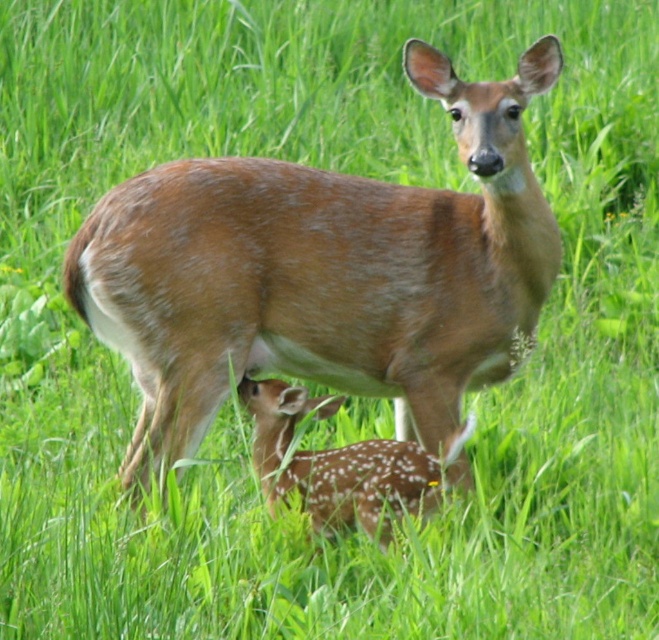
Who is positioned more to the right, brown fuzzy deer at center or fawn fur fawn at center?

Positioned to the right is fawn fur fawn at center.

Describe the element at coordinates (324, 273) in the screenshot. I see `brown fuzzy deer at center` at that location.

Who is more distant from viewer, [206,200] or [252,420]?

Point [252,420]

The height and width of the screenshot is (640, 659). I want to click on brown fuzzy deer at center, so click(324, 273).